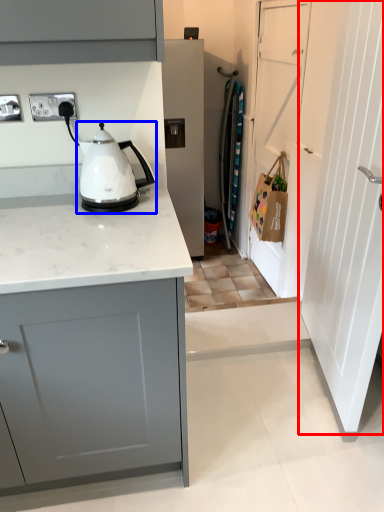
Question: Among these objects, which one is farthest to the camera, door (highlighted by a red box) or kitchen appliance (highlighted by a blue box)?

Choices:
 (A) door
 (B) kitchen appliance

Answer: (B)